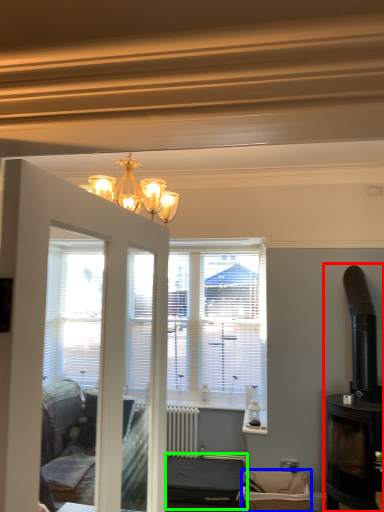
Question: Which object is positioned closest to fireplace (highlighted by a red box)? Select from furniture (highlighted by a blue box) and furniture (highlighted by a green box).

Choices:
 (A) furniture
 (B) furniture

Answer: (A)